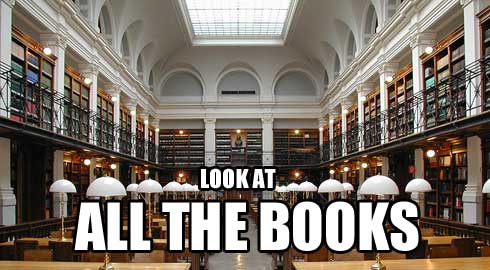
Where is `white dome lamp tops on left side`? The height and width of the screenshot is (270, 490). white dome lamp tops on left side is located at coordinates (65, 184), (102, 187), (154, 187), (134, 185), (175, 186), (185, 188), (194, 188).